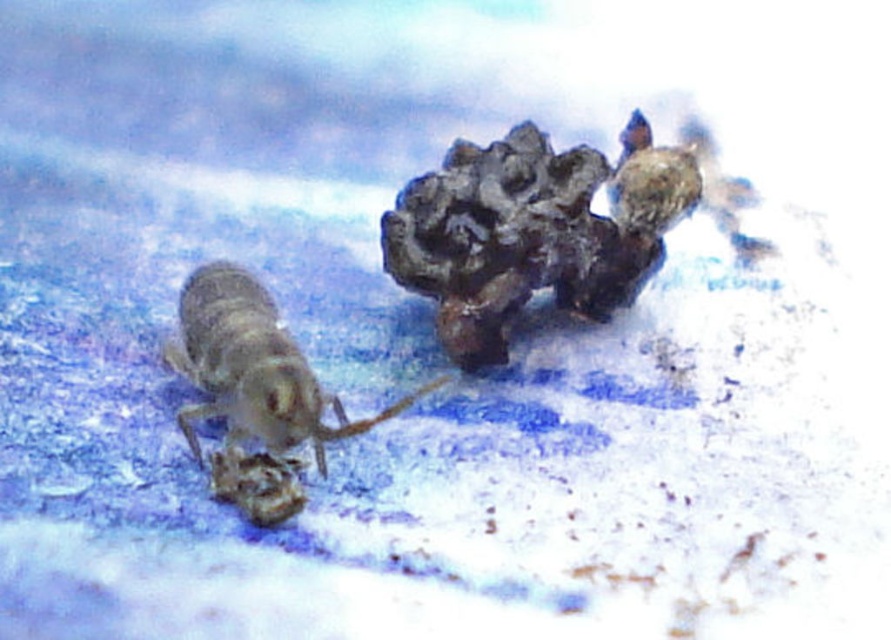
Does dark brown textured rock at upper right appear on the right side of translucent gray insect at left?

Indeed, dark brown textured rock at upper right is positioned on the right side of translucent gray insect at left.

Who is positioned more to the left, dark brown textured rock at upper right or translucent gray insect at left?

Positioned to the left is translucent gray insect at left.

Locate an element on the screen. This screenshot has width=891, height=640. dark brown textured rock at upper right is located at coordinates (533, 230).

Image resolution: width=891 pixels, height=640 pixels. Identify the location of dark brown textured rock at upper right. (533, 230).